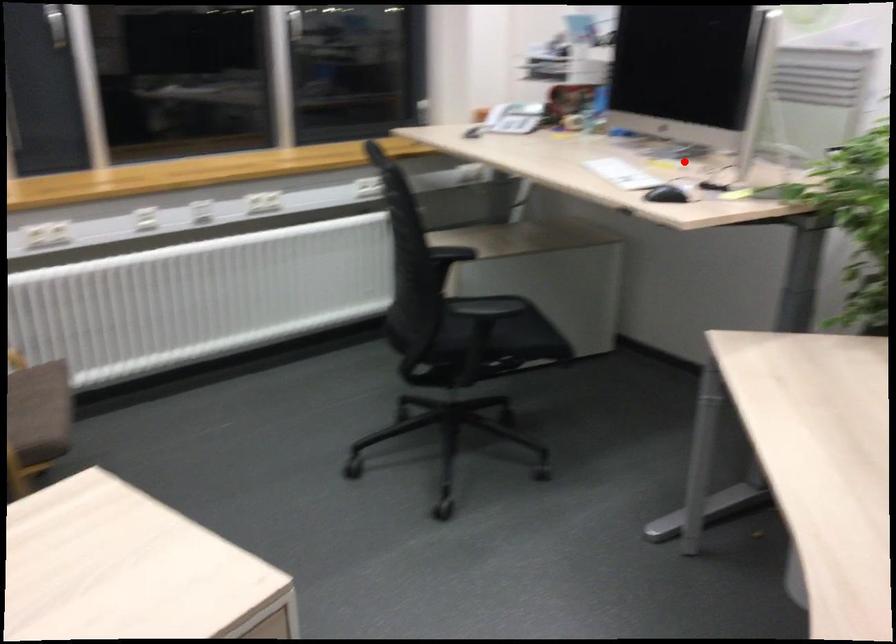
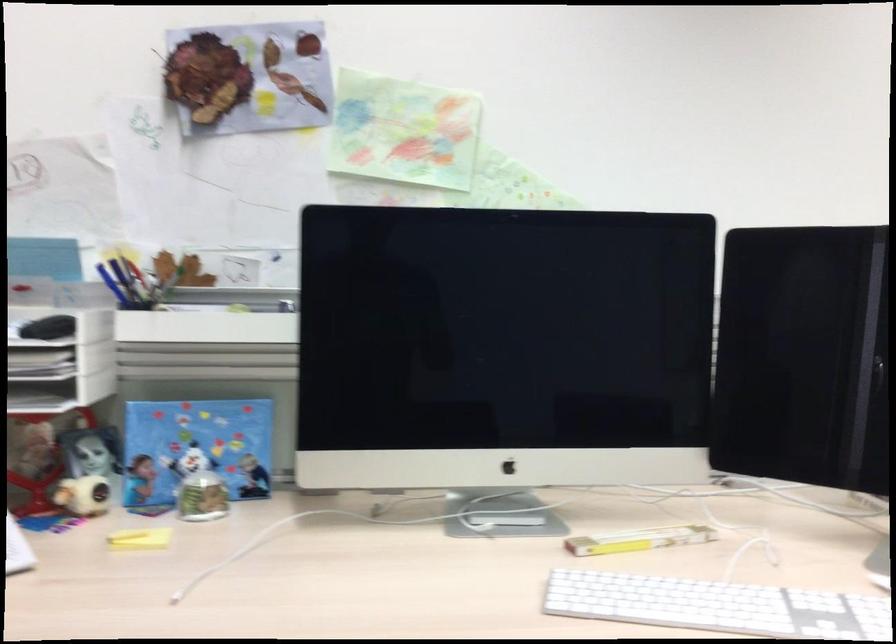
Find the pixel in the second image that matches the highlighted location in the first image.

(638, 540)